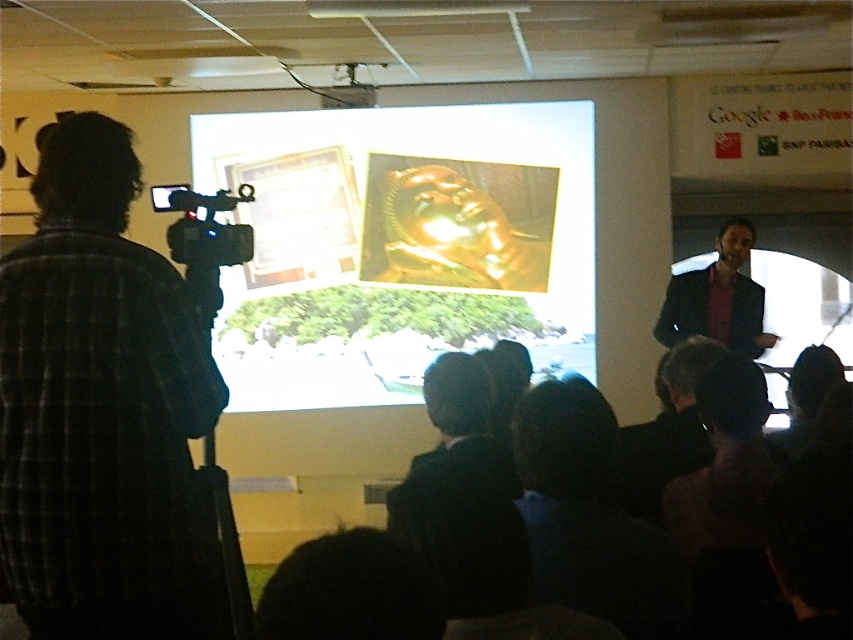
Question: Is the position of plaid shirt at left more distant than that of dark blue suit at right?

Choices:
 (A) no
 (B) yes

Answer: (A)

Question: Which point is closer to the camera?

Choices:
 (A) black fabric at lower center
 (B) dark blue suit at right

Answer: (A)

Question: Is plaid shirt at left further to the viewer compared to dark blue suit at right?

Choices:
 (A) yes
 (B) no

Answer: (B)

Question: Which point is farther to the camera?

Choices:
 (A) (810, 465)
 (B) (223, 193)

Answer: (B)

Question: Which point appears farthest from the camera in this image?

Choices:
 (A) (x=722, y=292)
 (B) (x=103, y=531)
 (C) (x=186, y=246)
 (D) (x=706, y=452)

Answer: (A)

Question: Can you confirm if plaid shirt at left is positioned below black fabric at lower center?

Choices:
 (A) no
 (B) yes

Answer: (A)